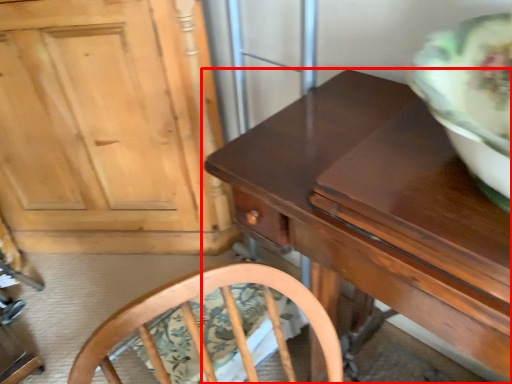
Question: From the image's perspective, where is table (annotated by the red box) located relative to cabinetry?

Choices:
 (A) above
 (B) below

Answer: (B)